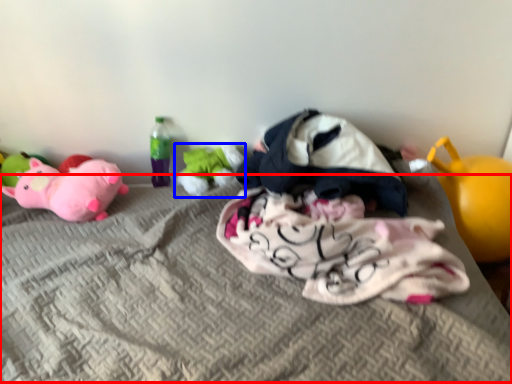
Question: Which of the following is the farthest to the observer, mattress (highlighted by a red box) or toy (highlighted by a blue box)?

Choices:
 (A) mattress
 (B) toy

Answer: (B)